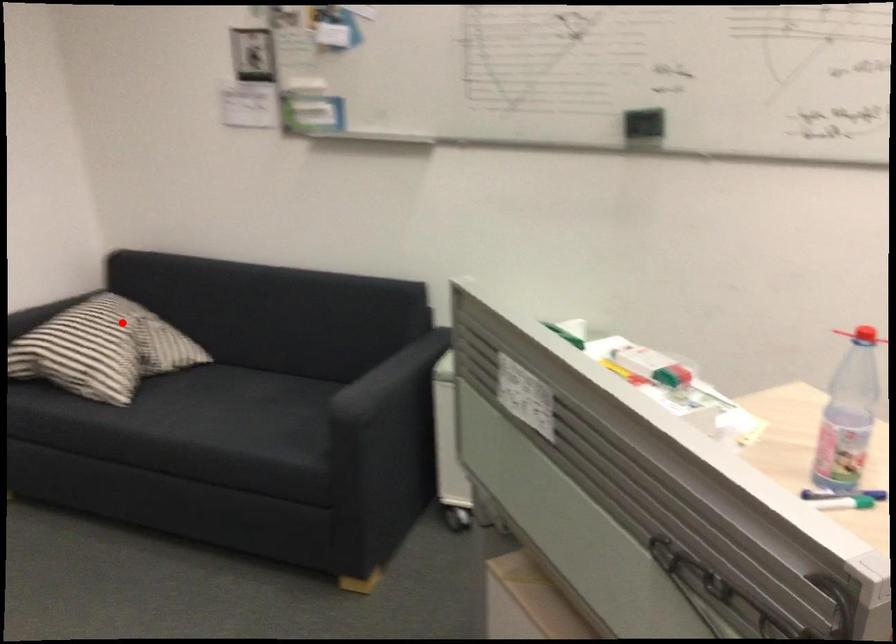
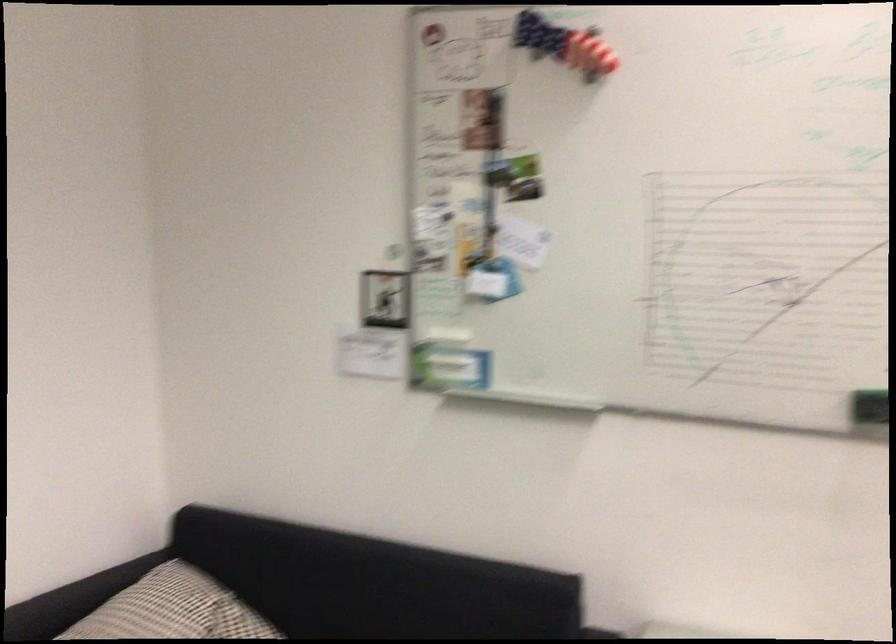
In the second image, find the point that corresponds to the highlighted location in the first image.

(193, 612)